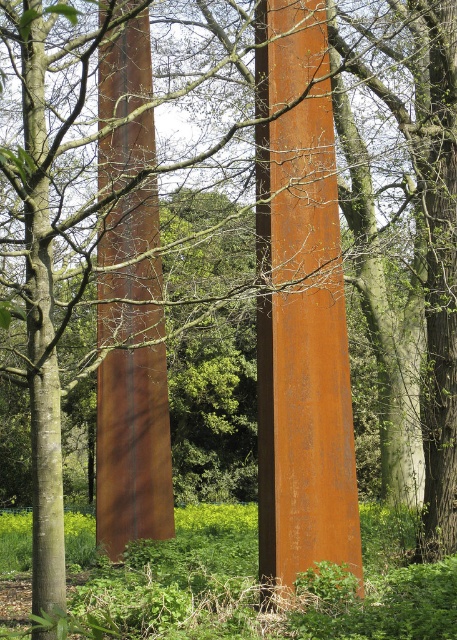
Question: Which of the following is the closest to the observer?

Choices:
 (A) (120, 529)
 (B) (274, 392)

Answer: (B)

Question: Which point is farther to the camera?

Choices:
 (A) (291, 435)
 (B) (105, 173)

Answer: (B)

Question: Considering the relative positions of rusty metal pole at center and rusty metal pillar at center in the image provided, where is rusty metal pole at center located with respect to rusty metal pillar at center?

Choices:
 (A) above
 (B) below

Answer: (A)

Question: Does rusty metal pole at center have a lesser width compared to rusty metal pillar at center?

Choices:
 (A) no
 (B) yes

Answer: (A)

Question: Does rusty metal pole at center have a larger size compared to rusty metal pillar at center?

Choices:
 (A) no
 (B) yes

Answer: (B)